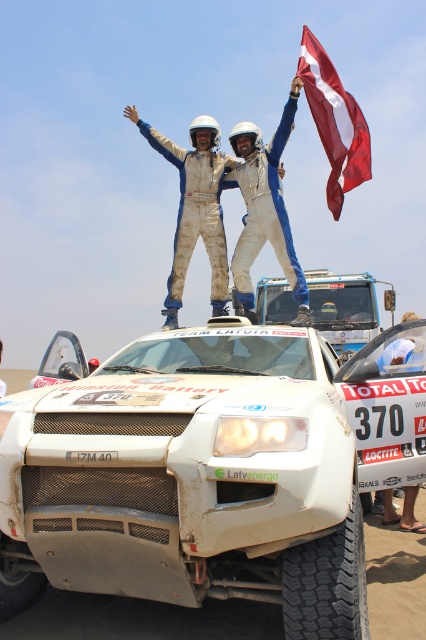
Is white fabric suit at center to the right of white fabric shirt at center from the viewer's perspective?

Incorrect, white fabric suit at center is not on the right side of white fabric shirt at center.

Does point (278, 134) come farther from viewer compared to point (396, 332)?

Yes, point (278, 134) is farther from viewer.

This screenshot has width=426, height=640. I want to click on white fabric suit at center, so click(264, 209).

At what (x,y) coordinates should I click in order to perform the action: click on white fabric suit at center. Please return your answer as a coordinate pair (x, y). Looking at the image, I should click on (264, 209).

Which is in front, point (316, 60) or point (417, 332)?

Point (417, 332)

Based on the photo, is red fabric flag at upper right shorter than white fabric shirt at center?

Indeed, red fabric flag at upper right has a lesser height compared to white fabric shirt at center.

Between point (333, 96) and point (425, 340), which one is positioned behind?

The point (333, 96) is behind.

Locate an element on the screen. This screenshot has height=640, width=426. red fabric flag at upper right is located at coordinates (334, 122).

Is point (218, 208) more distant than point (278, 195)?

Yes.

Is point (181, 148) less distant than point (255, 196)?

That is False.

Where is `white textured jumpsuit at center`? white textured jumpsuit at center is located at coordinates (195, 208).